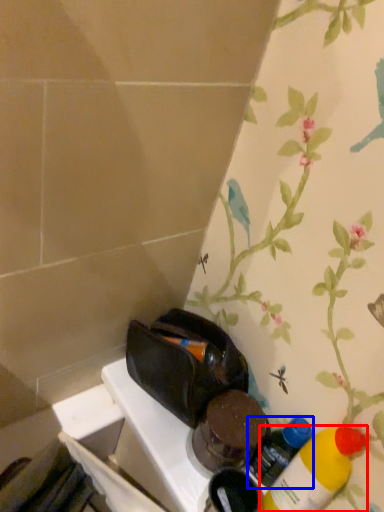
Question: Which of the following is the farthest to the observer, bottle (highlighted by a red box) or bottle (highlighted by a blue box)?

Choices:
 (A) bottle
 (B) bottle

Answer: (B)